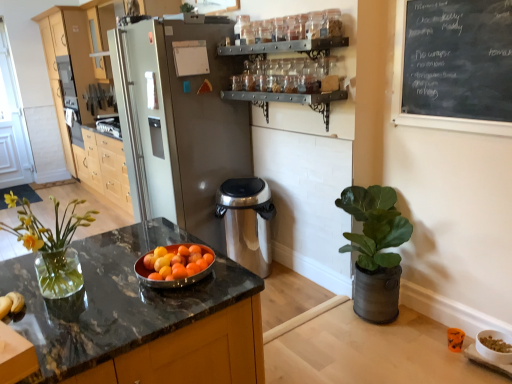
This screenshot has width=512, height=384. What are the coordinates of `vacant space in front of green matte plant at right` in the screenshot? It's located at (399, 349).